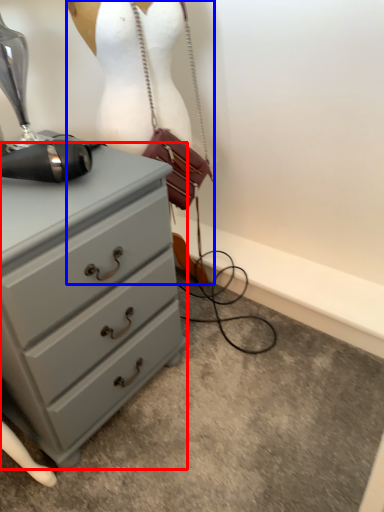
Question: Which of the following is the closest to the observer, chest of drawers (highlighted by a red box) or mannequin (highlighted by a blue box)?

Choices:
 (A) chest of drawers
 (B) mannequin

Answer: (A)